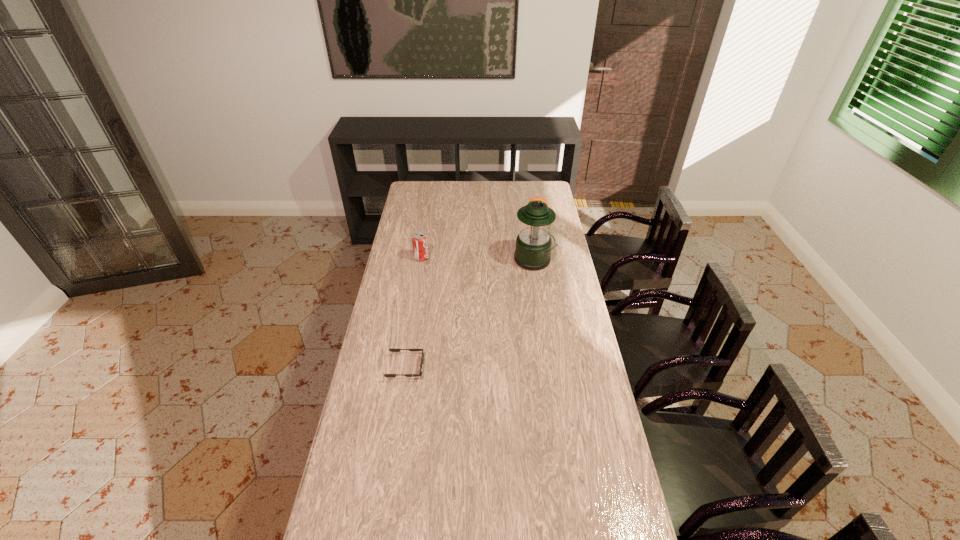
Find the location of a particular element. The height and width of the screenshot is (540, 960). the tallest object is located at coordinates (533, 246).

Find the location of a particular element. the second tallest object is located at coordinates (419, 239).

Locate an element on the screen. the farthest object is located at coordinates (539, 198).

The width and height of the screenshot is (960, 540). What are the coordinates of `orange` in the screenshot? It's located at (539, 198).

Identify the location of the nearest object. (391, 350).

Identify the location of the shortest object. The width and height of the screenshot is (960, 540). (391, 350).

Locate an element on the screen. vacant space located 0.190m on the back of the tallest object is located at coordinates (529, 227).

This screenshot has height=540, width=960. Identify the location of vacant position located 0.250m on the back of the third shortest object. (427, 224).

Where is `free point located 0.100m on the front of the second shortest object`? The width and height of the screenshot is (960, 540). free point located 0.100m on the front of the second shortest object is located at coordinates (540, 232).

Locate an element on the screen. vacant space positioned 0.140m on the temples of the nearest object is located at coordinates (462, 368).